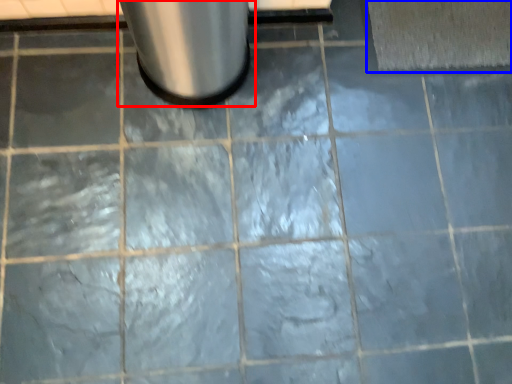
Question: Which object appears farthest to the camera in this image, waste container (highlighted by a red box) or bath mat (highlighted by a blue box)?

Choices:
 (A) waste container
 (B) bath mat

Answer: (B)